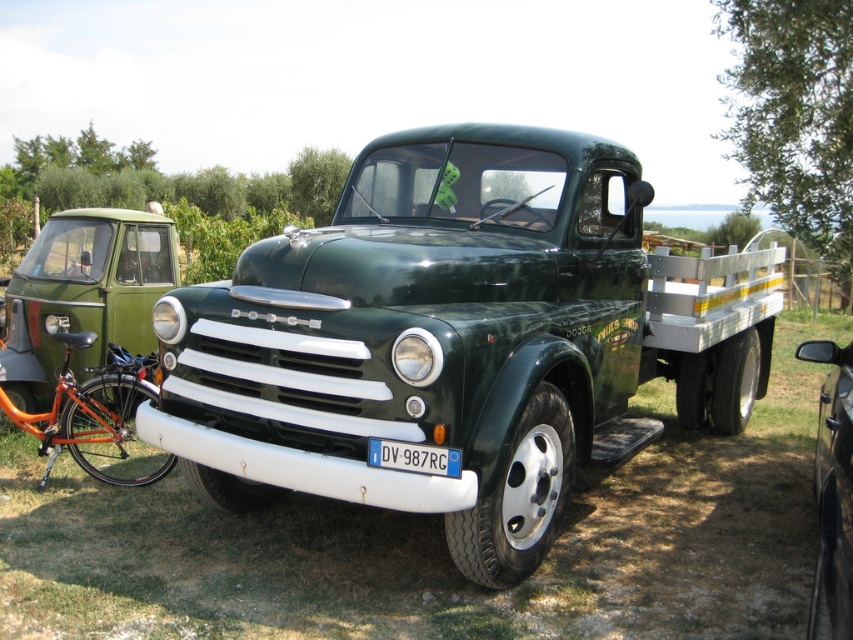
Does green matte van at left come in front of green matte truck at center?

No.

The width and height of the screenshot is (853, 640). Describe the element at coordinates (84, 294) in the screenshot. I see `green matte van at left` at that location.

Image resolution: width=853 pixels, height=640 pixels. I want to click on green matte van at left, so click(84, 294).

Does green metallic truck at center have a smaller size compared to green matte van at left?

No.

Who is positioned more to the right, green metallic truck at center or green matte van at left?

From the viewer's perspective, green metallic truck at center appears more on the right side.

Does point (596, 140) come in front of point (62, 257)?

Yes, it is.

Find the location of a particular element. This screenshot has width=853, height=640. green metallic truck at center is located at coordinates (456, 339).

Can you confirm if orange metallic bicycle at lower left is positioned to the left of blue metallic license plate at center?

Correct, you'll find orange metallic bicycle at lower left to the left of blue metallic license plate at center.

This screenshot has height=640, width=853. I want to click on orange metallic bicycle at lower left, so click(97, 417).